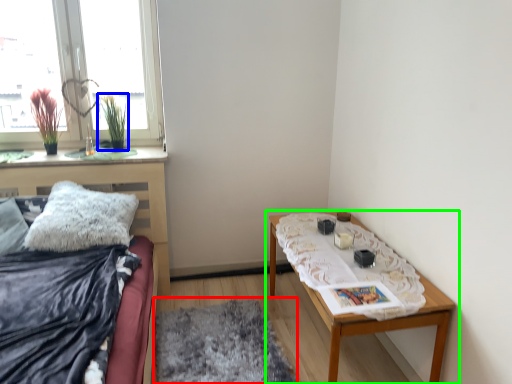
Question: Based on their relative distances, which object is nearer to mat (highlighted by a red box)? Choose from plant (highlighted by a blue box) and table (highlighted by a green box).

Choices:
 (A) plant
 (B) table

Answer: (B)